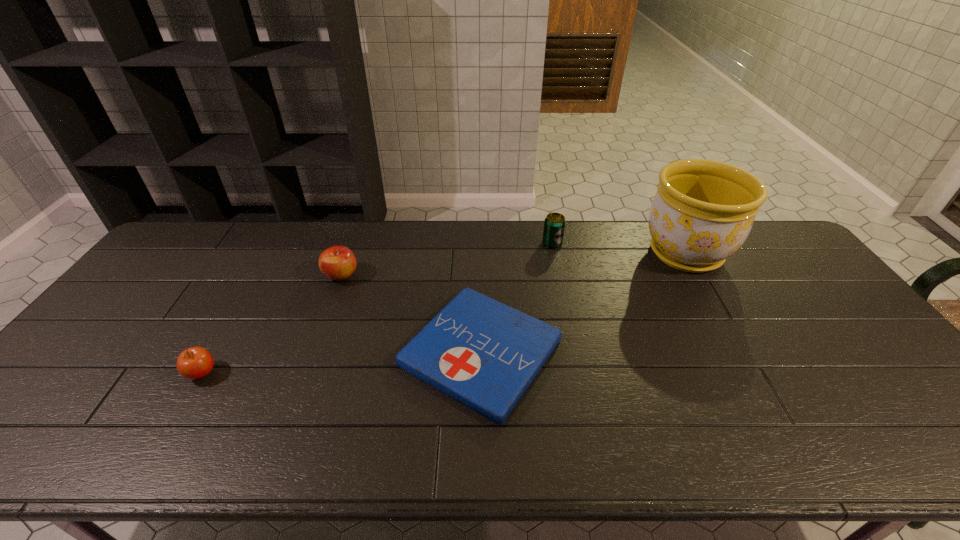
The height and width of the screenshot is (540, 960). Identify the location of vacant space situated 0.360m on the front of the right apple. (300, 388).

Where is `vacant area located 0.130m on the back of the nearer apple`? Image resolution: width=960 pixels, height=540 pixels. vacant area located 0.130m on the back of the nearer apple is located at coordinates (230, 323).

Find the location of a particular element. This screenshot has height=540, width=960. free region located on the right of the first-aid kit is located at coordinates (716, 352).

This screenshot has width=960, height=540. I want to click on flowerpot that is positioned at the far edge, so click(703, 211).

Where is `beer can positioned at the far edge`? The height and width of the screenshot is (540, 960). beer can positioned at the far edge is located at coordinates (554, 225).

This screenshot has width=960, height=540. What are the coordinates of `object that is positioned at the near edge` in the screenshot? It's located at (484, 354).

The width and height of the screenshot is (960, 540). I want to click on blank area at the far edge, so click(460, 224).

Locate an element on the screen. The height and width of the screenshot is (540, 960). vacant region at the near edge of the desktop is located at coordinates (618, 454).

You are a GUI agent. You are given a task and a screenshot of the screen. Output one action in this format:
    pyautogui.click(x=<x>, y=<y>)
    Task: Click on the free space at the left edge of the desktop
    This screenshot has height=540, width=960.
    Given the screenshot: What is the action you would take?
    click(156, 270)

Image resolution: width=960 pixels, height=540 pixels. I want to click on vacant region at the right edge of the desktop, so click(789, 295).